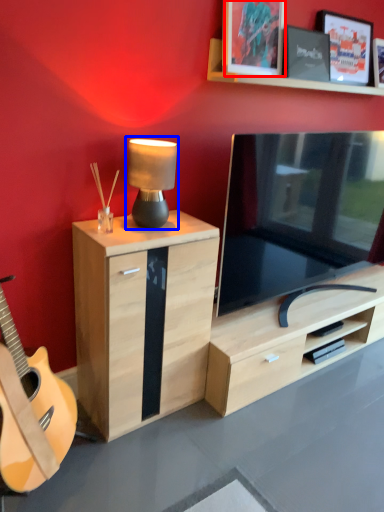
Question: Which object appears closest to the camera in this image, picture frame (highlighted by a red box) or table lamp (highlighted by a blue box)?

Choices:
 (A) picture frame
 (B) table lamp

Answer: (B)